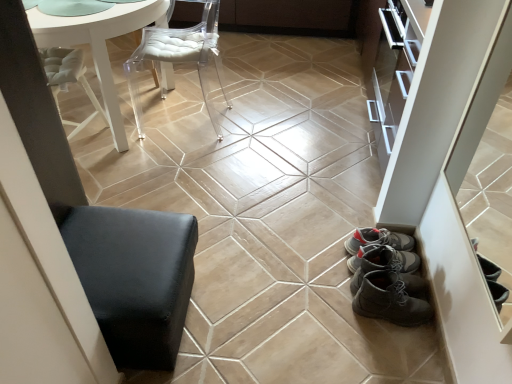
Locate an element on the screen. vacant region under transparent acrylic chair at upper center (from a real-world perspective) is located at coordinates (204, 122).